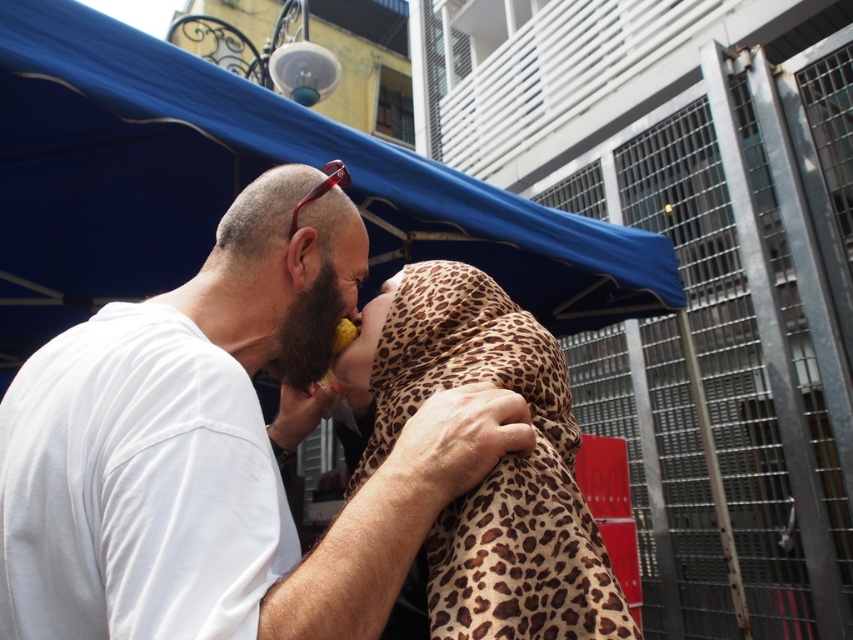
Is white matte shirt at center taller than blue fabric canopy at upper center?

No.

Between white matte shirt at center and blue fabric canopy at upper center, which one has less height?

white matte shirt at center is shorter.

The width and height of the screenshot is (853, 640). What do you see at coordinates (218, 449) in the screenshot?
I see `white matte shirt at center` at bounding box center [218, 449].

You are a GUI agent. You are given a task and a screenshot of the screen. Output one action in this format:
    pyautogui.click(x=<x>, y=<y>)
    Task: Click on the white matte shirt at center
    The width and height of the screenshot is (853, 640).
    Given the screenshot: What is the action you would take?
    pyautogui.click(x=218, y=449)